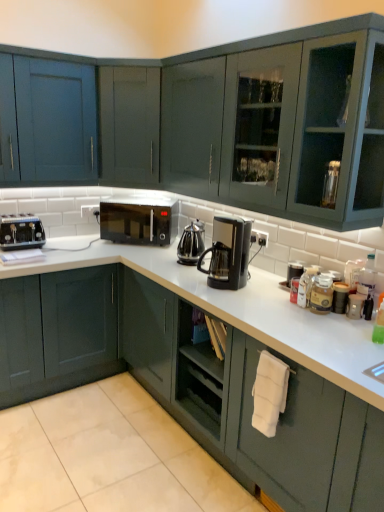
Question: From a real-world perspective, is black plastic coffee maker at center under matte blue cabinet at upper left, placed as the first cabinetry when sorted from top to bottom?

Choices:
 (A) yes
 (B) no

Answer: (A)

Question: Considering the relative sizes of black plastic coffee maker at center and matte blue cabinet at upper left, placed as the first cabinetry when sorted from top to bottom, in the image provided, is black plastic coffee maker at center thinner than matte blue cabinet at upper left, placed as the first cabinetry when sorted from top to bottom,?

Choices:
 (A) no
 (B) yes

Answer: (B)

Question: Are black plastic coffee maker at center and matte blue cabinet at upper left, placed as the first cabinetry when sorted from top to bottom, located far from each other?

Choices:
 (A) yes
 (B) no

Answer: (A)

Question: From the image's perspective, does black plastic coffee maker at center appear higher than matte blue cabinet at upper left, acting as the second cabinetry starting from the bottom?

Choices:
 (A) no
 (B) yes

Answer: (A)

Question: Is black plastic coffee maker at center facing away from matte blue cabinet at upper left, acting as the second cabinetry starting from the bottom?

Choices:
 (A) no
 (B) yes

Answer: (A)

Question: Does point (352, 298) appear closer or farther from the camera than point (31, 361)?

Choices:
 (A) closer
 (B) farther

Answer: (A)

Question: Is metallic silver canister at right bigger or smaller than matte dark green cabinet at lower left, arranged as the second cabinetry when viewed from the top?

Choices:
 (A) small
 (B) big

Answer: (A)

Question: From the image's perspective, relative to matte dark green cabinet at lower left, arranged as the second cabinetry when viewed from the top, is metallic silver canister at right above or below?

Choices:
 (A) above
 (B) below

Answer: (A)

Question: In the image, is metallic silver canister at right positioned in front of or behind matte dark green cabinet at lower left, which ranks as the first cabinetry in bottom-to-top order?

Choices:
 (A) behind
 (B) front

Answer: (B)

Question: Looking at their shapes, would you say black matte microwave at center is wider or thinner than black plastic coffee maker at center?

Choices:
 (A) wide
 (B) thin

Answer: (A)

Question: Considering the positions of black matte microwave at center and black plastic coffee maker at center in the image, is black matte microwave at center taller or shorter than black plastic coffee maker at center?

Choices:
 (A) tall
 (B) short

Answer: (B)

Question: From a real-world perspective, is black matte microwave at center above or below black plastic coffee maker at center?

Choices:
 (A) below
 (B) above

Answer: (A)

Question: From the image's perspective, is black matte microwave at center above or below black plastic coffee maker at center?

Choices:
 (A) above
 (B) below

Answer: (A)

Question: Is point (251, 385) positioned closer to the camera than point (18, 324)?

Choices:
 (A) closer
 (B) farther

Answer: (A)

Question: In the image, is white matte towel at lower right on the left side or the right side of matte dark green cabinet at lower left, which ranks as the first cabinetry in bottom-to-top order?

Choices:
 (A) right
 (B) left

Answer: (A)